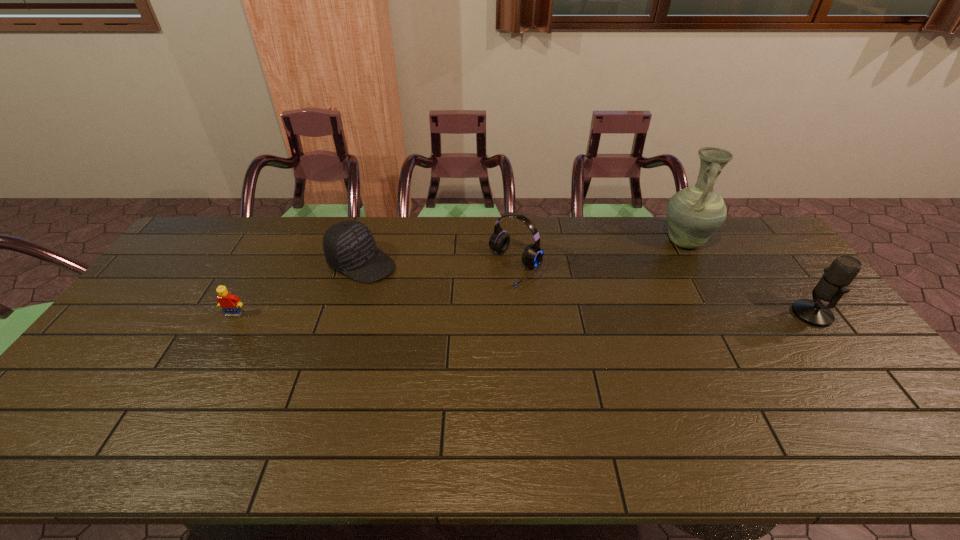
The image size is (960, 540). What are the coordinates of `the shortest object` in the screenshot? It's located at (229, 303).

Locate an element on the screen. the leftmost object is located at coordinates (229, 303).

The width and height of the screenshot is (960, 540). I want to click on the rightmost object, so click(x=835, y=282).

Identify the location of the fourth tallest object. (349, 246).

Where is `the second object from left to right`? The image size is (960, 540). the second object from left to right is located at coordinates (349, 246).

Locate an element on the screen. This screenshot has height=540, width=960. the third object from right to left is located at coordinates (499, 241).

Identify the location of the tallest object. (694, 213).

Where is `pitcher`? This screenshot has width=960, height=540. pitcher is located at coordinates (694, 213).

This screenshot has height=540, width=960. I want to click on free space located 0.160m on the front-facing side of the leftmost object, so click(x=207, y=363).

Image resolution: width=960 pixels, height=540 pixels. In order to click on free region located at the front of the second object from left to right where the brim is located in this screenshot , I will do `click(407, 284)`.